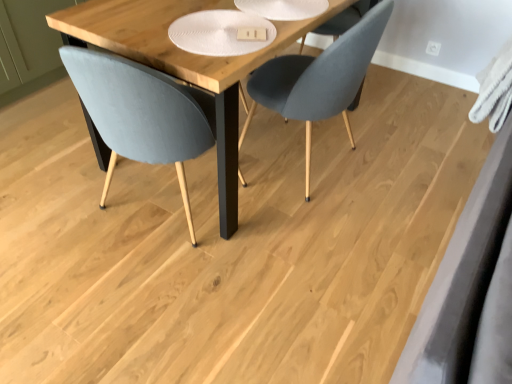
Image resolution: width=512 pixels, height=384 pixels. In order to click on vacant area to the left of matte gray chair at left, which is the second chair from right to left in this screenshot , I will do `click(56, 204)`.